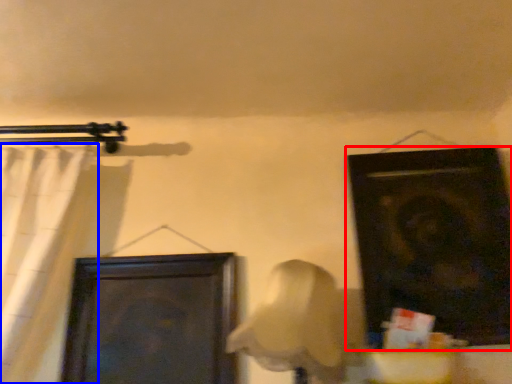
Question: Among these objects, which one is farthest to the camera, door (highlighted by a red box) or curtain (highlighted by a blue box)?

Choices:
 (A) door
 (B) curtain

Answer: (A)